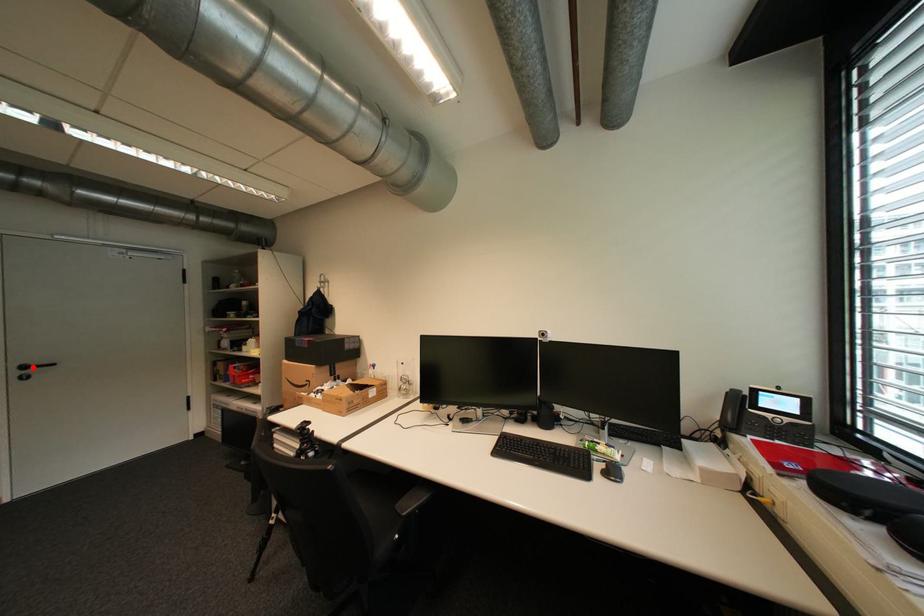
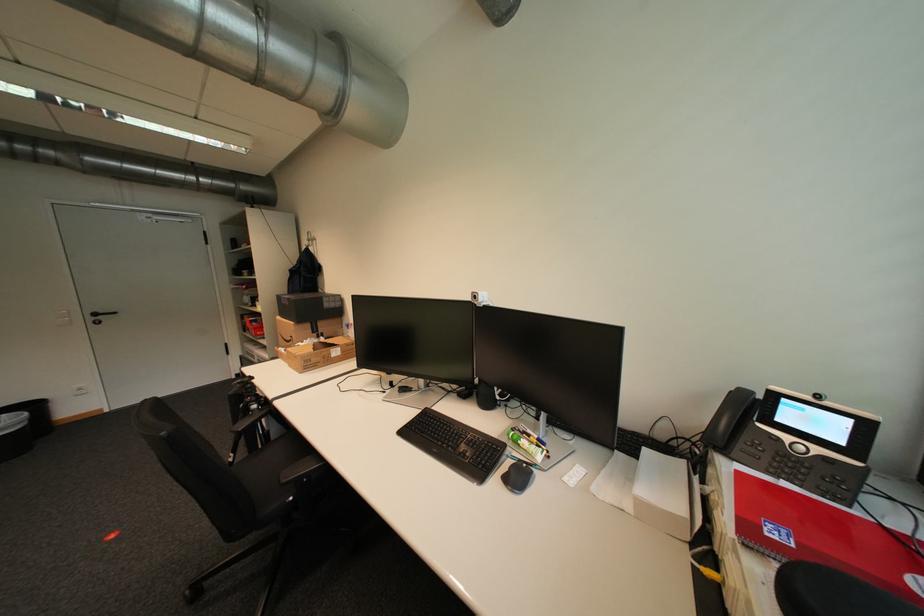
Find the pixel in the second image that matches the highlighted location in the first image.

(103, 315)